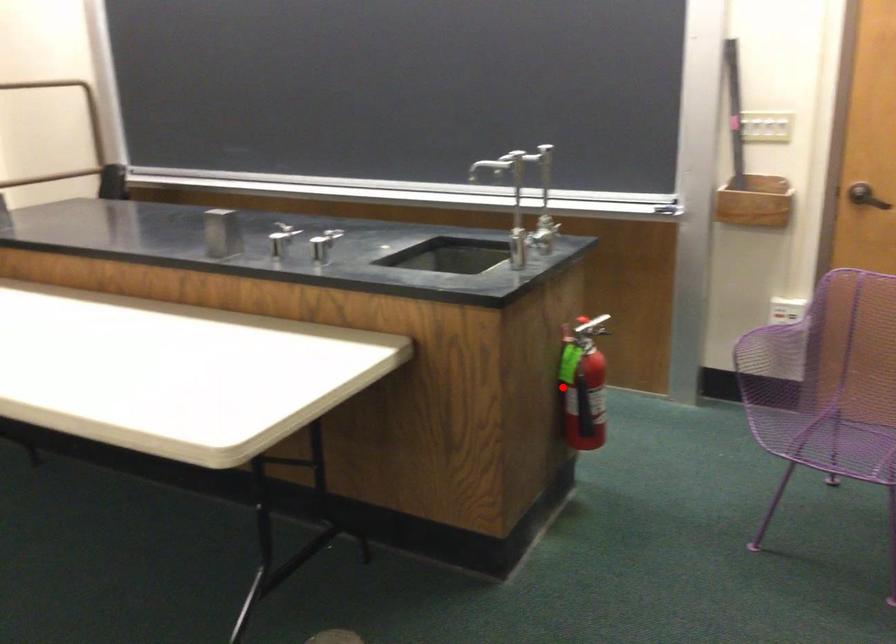
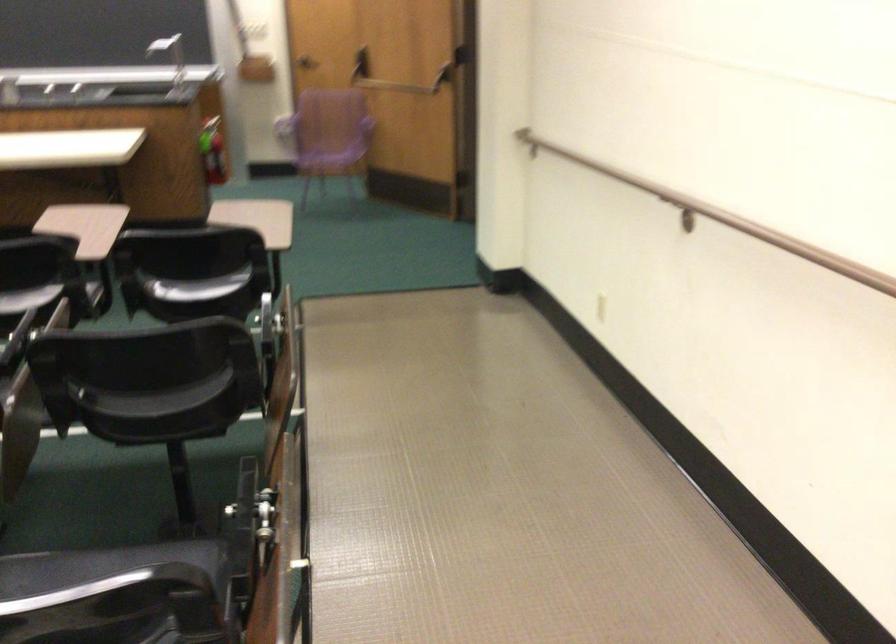
Question: I am providing you with two images of the same scene from different viewpoints. A red point is shown in image1. For the corresponding object point in image2, is it positioned nearer or farther from the camera?

Choices:
 (A) Nearer
 (B) Farther

Answer: (B)